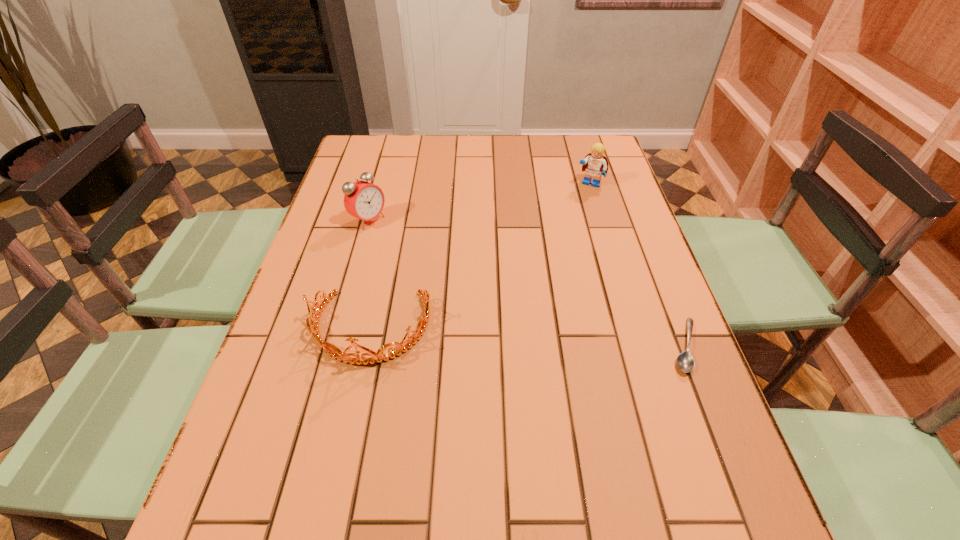
Find the location of a particular element. free spot on the desktop that is between the tiara and the shortest object and is positioned on the front-facing side of the third object from left to right is located at coordinates (514, 336).

At what (x,y) coordinates should I click in order to perform the action: click on free space on the desktop that is between the tiara and the shortest object and is positioned on the front-facing side of the third nearest object. Please return your answer as a coordinate pair (x, y). Looking at the image, I should click on (566, 339).